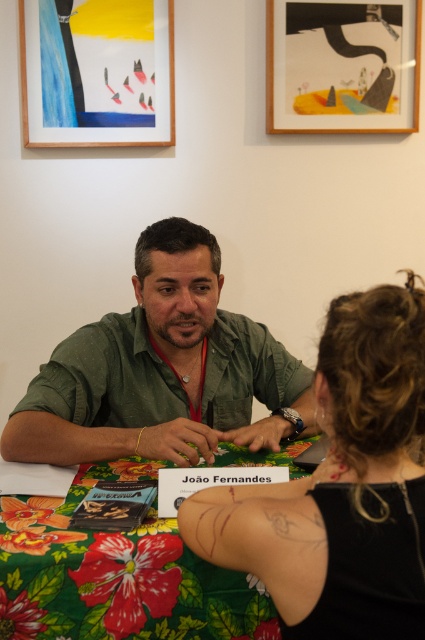
Question: Does black fabric hair at center come in front of green matte shirt at center?

Choices:
 (A) no
 (B) yes

Answer: (B)

Question: Is green matte shirt at center further to the viewer compared to floral fabric tablecloth at center?

Choices:
 (A) yes
 (B) no

Answer: (A)

Question: Which point is farther to the camera?

Choices:
 (A) (354, 568)
 (B) (82, 566)

Answer: (B)

Question: Which is nearer to the green matte shirt at center?

Choices:
 (A) floral fabric tablecloth at center
 (B) black fabric hair at center

Answer: (A)

Question: Which point is closer to the camera?

Choices:
 (A) (266, 605)
 (B) (70, 401)
 (C) (343, 534)

Answer: (C)

Question: Does green matte shirt at center have a larger size compared to floral fabric tablecloth at center?

Choices:
 (A) yes
 (B) no

Answer: (A)